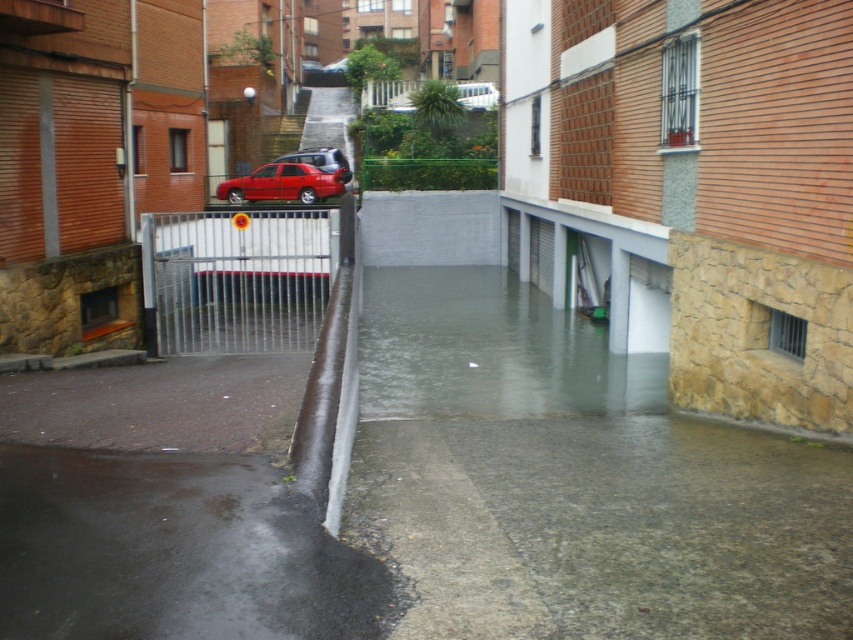
Between glossy asphalt puddle at lower left and metallic red car at center, which one has more height?

With more height is metallic red car at center.

You are a GUI agent. You are given a task and a screenshot of the screen. Output one action in this format:
    pyautogui.click(x=<x>, y=<y>)
    Task: Click on the glossy asphalt puddle at lower left
    
    Given the screenshot: What is the action you would take?
    pyautogui.click(x=172, y=550)

Locate an element on the screen. The width and height of the screenshot is (853, 640). glossy asphalt puddle at lower left is located at coordinates (172, 550).

Does glossy asphalt puddle at lower left lie in front of shiny red car at center?

Yes, glossy asphalt puddle at lower left is closer to the viewer.

Does glossy asphalt puddle at lower left appear on the left side of shiny red car at center?

In fact, glossy asphalt puddle at lower left is to the right of shiny red car at center.

Does point (62, 604) come closer to viewer compared to point (300, 186)?

Yes, point (62, 604) is closer to viewer.

What are the coordinates of `glossy asphalt puddle at lower left` in the screenshot? It's located at (172, 550).

Can you confirm if shiny red car at center is smaller than metallic red car at center?

Correct, shiny red car at center occupies less space than metallic red car at center.

Can you confirm if shiny red car at center is positioned to the left of metallic red car at center?

Correct, you'll find shiny red car at center to the left of metallic red car at center.

What are the coordinates of `shiny red car at center` in the screenshot? It's located at (283, 182).